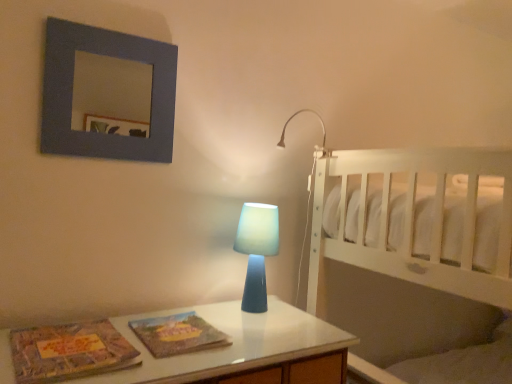
Question: Is the depth of blue translucent lamp at upper right, which is the second lamp from bottom to top, greater than that of textured paper magazine at center, placed as the second magazine when sorted from left to right?

Choices:
 (A) yes
 (B) no

Answer: (A)

Question: From the image's perspective, does blue translucent lamp at upper right, which is the second lamp from bottom to top, appear lower than textured paper magazine at center, placed as the second magazine when sorted from left to right?

Choices:
 (A) no
 (B) yes

Answer: (A)

Question: Is blue translucent lamp at upper right, which is the first lamp from top to bottom, far from textured paper magazine at center, which appears as the first magazine when viewed from the right?

Choices:
 (A) yes
 (B) no

Answer: (B)

Question: Is blue translucent lamp at upper right, which is the second lamp from bottom to top, thinner than textured paper magazine at center, placed as the second magazine when sorted from left to right?

Choices:
 (A) no
 (B) yes

Answer: (B)

Question: Is blue translucent lamp at upper right, which appears as the second lamp when viewed from the left, bigger than textured paper magazine at center, which appears as the first magazine when viewed from the right?

Choices:
 (A) no
 (B) yes

Answer: (B)

Question: Considering the relative sizes of blue translucent lamp at upper right, which is the second lamp from bottom to top, and textured paper magazine at center, placed as the second magazine when sorted from left to right, in the image provided, is blue translucent lamp at upper right, which is the second lamp from bottom to top, taller than textured paper magazine at center, placed as the second magazine when sorted from left to right,?

Choices:
 (A) no
 (B) yes

Answer: (B)

Question: Is textured paper magazine at center, placed as the second magazine when sorted from left to right, wider than blue translucent lamp at center, the 1th lamp ordered from the bottom?

Choices:
 (A) yes
 (B) no

Answer: (A)

Question: Is textured paper magazine at center, which appears as the first magazine when viewed from the right, far from blue translucent lamp at center, the 1th lamp ordered from the bottom?

Choices:
 (A) yes
 (B) no

Answer: (B)

Question: From the image's perspective, would you say textured paper magazine at center, which appears as the first magazine when viewed from the right, is positioned over blue translucent lamp at center, the 1th lamp ordered from the bottom?

Choices:
 (A) yes
 (B) no

Answer: (B)

Question: Can blue translucent lamp at center, the 1th lamp positioned from the left, be found inside textured paper magazine at center, which appears as the first magazine when viewed from the right?

Choices:
 (A) yes
 (B) no

Answer: (B)

Question: Is textured paper magazine at center, which appears as the first magazine when viewed from the right, behind blue translucent lamp at center, marked as the 2th lamp in a top-to-bottom arrangement?

Choices:
 (A) no
 (B) yes

Answer: (A)

Question: Does textured paper magazine at center, which appears as the first magazine when viewed from the right, have a lesser height compared to blue translucent lamp at center, the 1th lamp positioned from the left?

Choices:
 (A) no
 (B) yes

Answer: (B)

Question: From the image's perspective, does white wooden bed at right appear higher than matte gray picture frame at upper left?

Choices:
 (A) yes
 (B) no

Answer: (B)